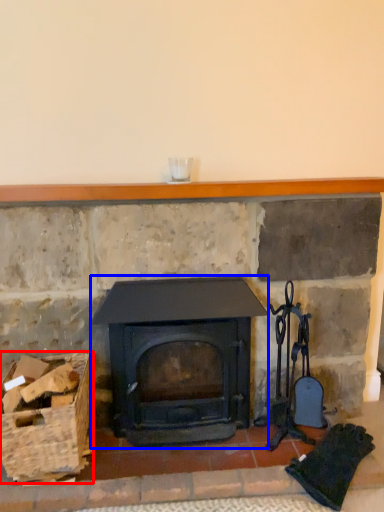
Question: Which point is further to the camera, basket (highlighted by a red box) or wood burning stove (highlighted by a blue box)?

Choices:
 (A) basket
 (B) wood burning stove

Answer: (B)